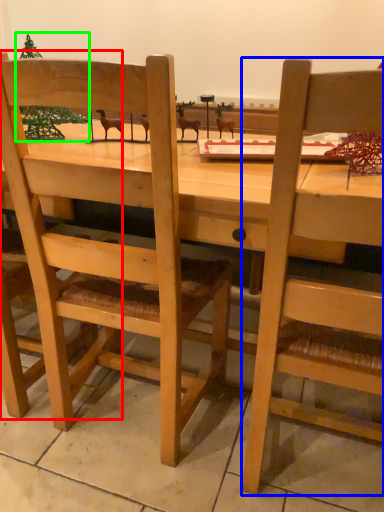
Question: Based on their relative distances, which object is farther from chair (highlighted by a red box)? Choose from chair (highlighted by a blue box) and christmas tree (highlighted by a green box).

Choices:
 (A) chair
 (B) christmas tree

Answer: (A)